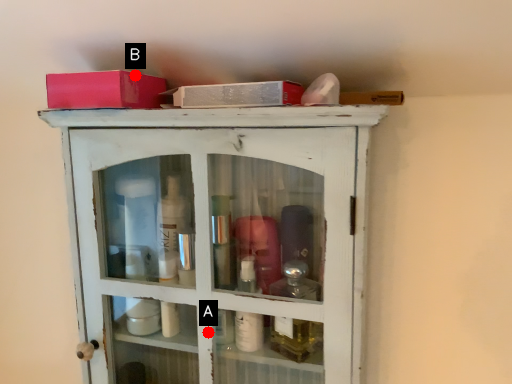
Question: Two points are circled on the image, labeled by A and B beside each circle. Which point is closer to the camera?

Choices:
 (A) A is closer
 (B) B is closer

Answer: (B)